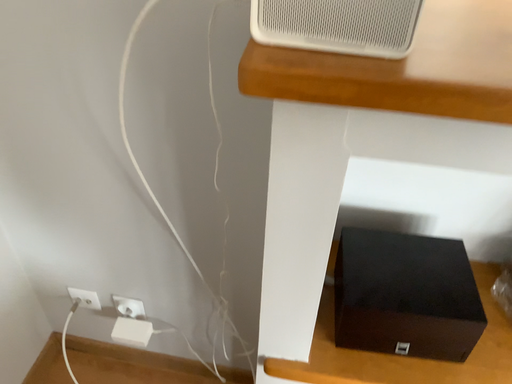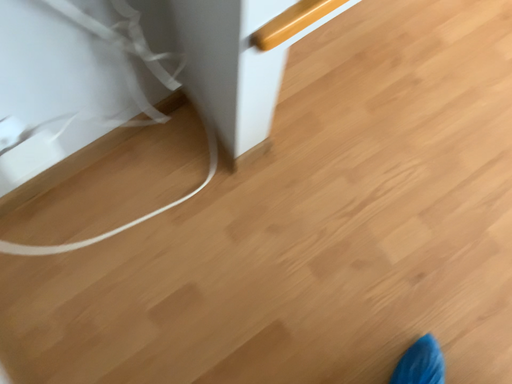
Question: How did the camera likely rotate when shooting the video?

Choices:
 (A) rotated right
 (B) rotated left

Answer: (A)